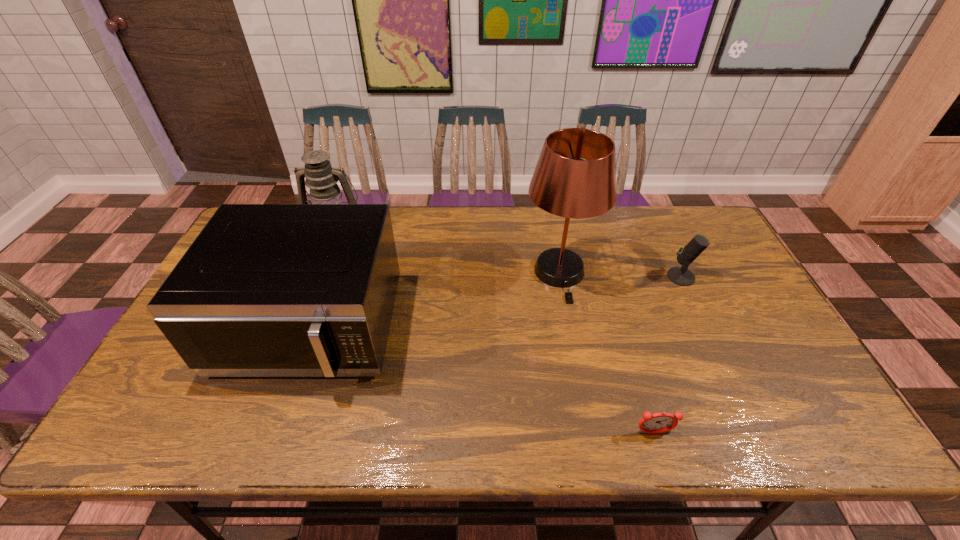
Locate an element on the screen. The width and height of the screenshot is (960, 540). the tallest object is located at coordinates (575, 177).

Locate an element on the screen. The width and height of the screenshot is (960, 540). the farthest object is located at coordinates (321, 178).

The height and width of the screenshot is (540, 960). Find the location of `microwave_oven`. microwave_oven is located at coordinates (265, 290).

At what (x,y) coordinates should I click in order to perform the action: click on the second shortest object. Please return your answer as a coordinate pair (x, y). The height and width of the screenshot is (540, 960). Looking at the image, I should click on (681, 276).

At what (x,y) coordinates should I click in order to perform the action: click on microphone. Please return your answer as a coordinate pair (x, y). The height and width of the screenshot is (540, 960). Looking at the image, I should click on (681, 276).

Locate an element on the screen. the shortest object is located at coordinates (656, 423).

In order to click on the nearest object in this screenshot , I will do `click(656, 423)`.

Find the location of a particular element. The width and height of the screenshot is (960, 540). vacant space located on the front-facing side of the tallest object is located at coordinates (589, 430).

Where is `vacant space situated 0.370m on the front of the farthest object`? The height and width of the screenshot is (540, 960). vacant space situated 0.370m on the front of the farthest object is located at coordinates coord(299,335).

Identify the location of vacant space located on the front-facing side of the microwave_oven. The width and height of the screenshot is (960, 540). (272, 438).